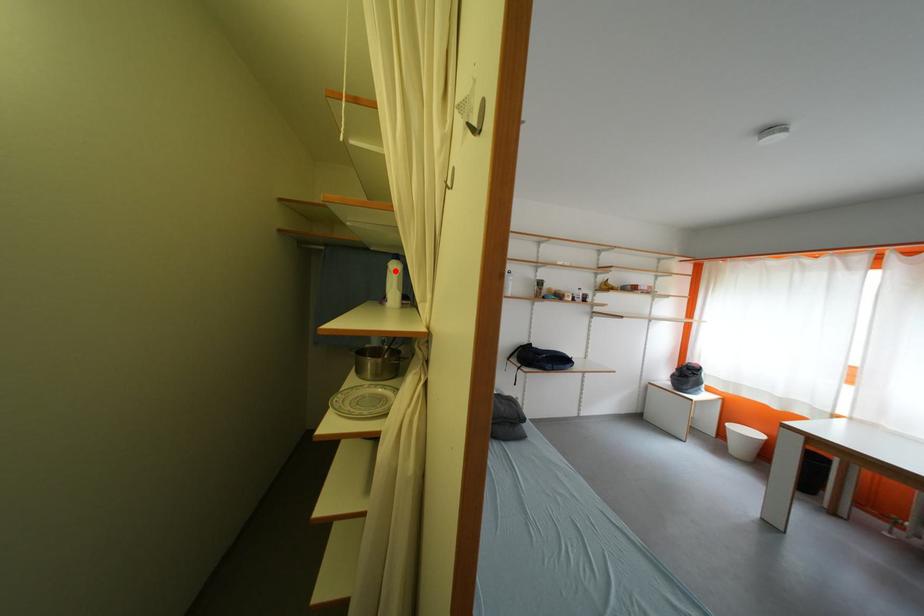
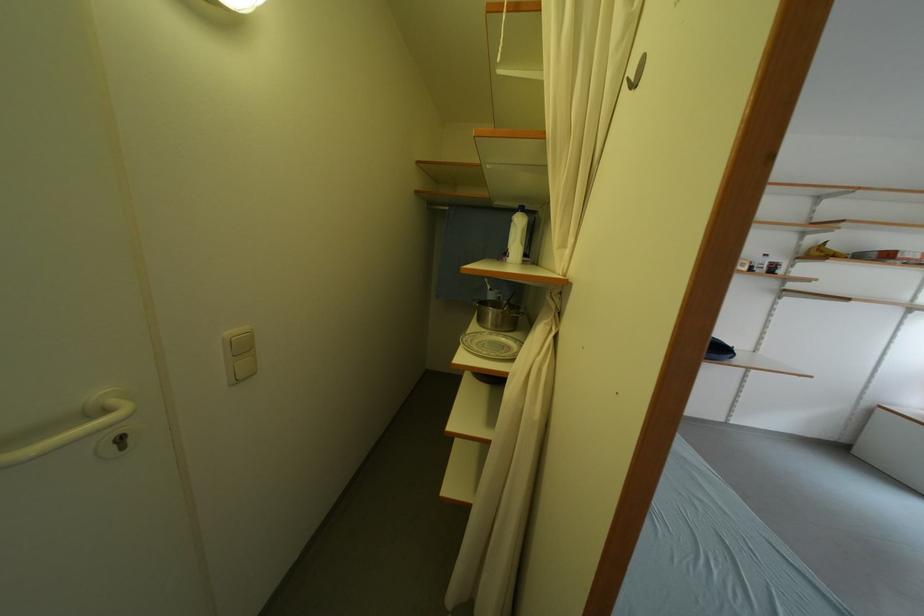
Question: I am providing you with two images of the same scene from different viewpoints. A red point is marked on the first image. At the location where the point appears in image 1, is it still visible in image 2?

Choices:
 (A) Yes
 (B) No

Answer: (A)